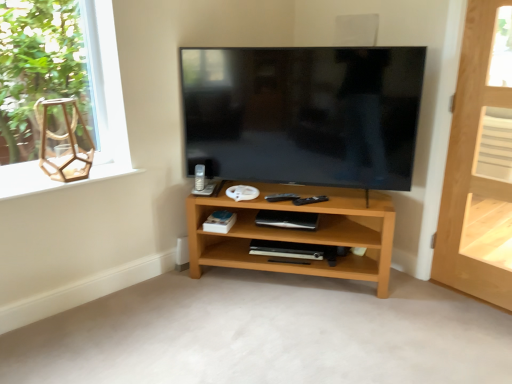
Question: From the image's perspective, does light brown wood shelf at center, marked as the first shelf in a left-to-right arrangement, appear lower than wooden hexagon at upper left?

Choices:
 (A) no
 (B) yes

Answer: (B)

Question: Does light brown wood shelf at center, placed as the second shelf when sorted from back to front, appear on the left side of wooden hexagon at upper left?

Choices:
 (A) yes
 (B) no

Answer: (B)

Question: Is light brown wood shelf at center, placed as the second shelf when sorted from back to front, facing towards wooden hexagon at upper left?

Choices:
 (A) yes
 (B) no

Answer: (B)

Question: Is light brown wood shelf at center, marked as the first shelf in a left-to-right arrangement, bigger than wooden hexagon at upper left?

Choices:
 (A) no
 (B) yes

Answer: (B)

Question: Is light brown wood shelf at center, placed as the second shelf when sorted from back to front, not close to wooden hexagon at upper left?

Choices:
 (A) yes
 (B) no

Answer: (B)

Question: From the image's perspective, is light brown wooden door at right positioned above or below matte black tv at center?

Choices:
 (A) below
 (B) above

Answer: (A)

Question: Considering the positions of point (450, 142) and point (364, 52), is point (450, 142) closer or farther from the camera than point (364, 52)?

Choices:
 (A) farther
 (B) closer

Answer: (A)

Question: Looking at their shapes, would you say light brown wooden door at right is wider or thinner than matte black tv at center?

Choices:
 (A) wide
 (B) thin

Answer: (B)

Question: Is light brown wooden door at right in front of or behind matte black tv at center in the image?

Choices:
 (A) front
 (B) behind

Answer: (A)

Question: Considering the positions of white matte speaker at upper center and light brown wood shelf at center, marked as the first shelf in a left-to-right arrangement, in the image, is white matte speaker at upper center wider or thinner than light brown wood shelf at center, marked as the first shelf in a left-to-right arrangement,?

Choices:
 (A) thin
 (B) wide

Answer: (A)

Question: Considering the relative positions of white matte speaker at upper center and light brown wood shelf at center, which ranks as the 2th shelf in right-to-left order, in the image provided, is white matte speaker at upper center to the left or to the right of light brown wood shelf at center, which ranks as the 2th shelf in right-to-left order,?

Choices:
 (A) right
 (B) left

Answer: (A)

Question: From the image's perspective, is white matte speaker at upper center located above or below light brown wood shelf at center, marked as the first shelf in a left-to-right arrangement?

Choices:
 (A) below
 (B) above

Answer: (B)

Question: In terms of size, does white matte speaker at upper center appear bigger or smaller than light brown wood shelf at center, placed as the second shelf when sorted from back to front?

Choices:
 (A) big
 (B) small

Answer: (B)

Question: Is wooden hexagon at upper left wider or thinner than matte black tv at center?

Choices:
 (A) thin
 (B) wide

Answer: (B)

Question: Would you say wooden hexagon at upper left is to the left or to the right of matte black tv at center in the picture?

Choices:
 (A) right
 (B) left

Answer: (B)